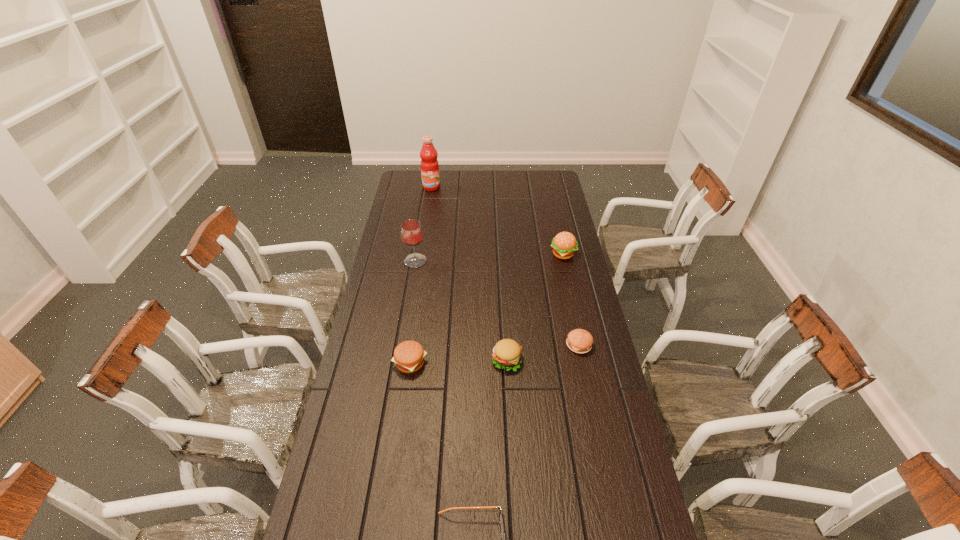
Where is `free spot that satisfies the following two spatial constraints: 1. on the front label of the tallest object; 2. on the right side of the leftmost hamburger`? The width and height of the screenshot is (960, 540). free spot that satisfies the following two spatial constraints: 1. on the front label of the tallest object; 2. on the right side of the leftmost hamburger is located at coordinates (404, 363).